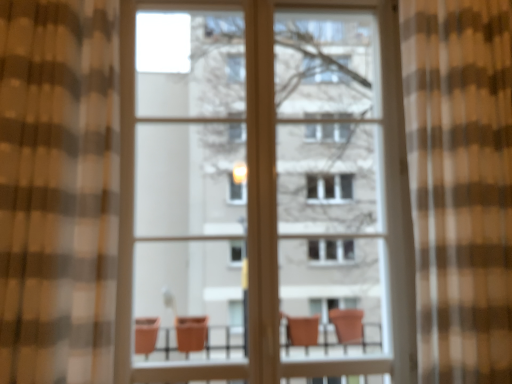
Question: From their relative heights in the image, would you say brown sheer curtain at right, marked as the first curtain in a right-to-left arrangement, is taller or shorter than matte glass screen door at center?

Choices:
 (A) tall
 (B) short

Answer: (B)

Question: Considering the positions of brown sheer curtain at right, marked as the first curtain in a right-to-left arrangement, and matte glass screen door at center in the image, is brown sheer curtain at right, marked as the first curtain in a right-to-left arrangement, bigger or smaller than matte glass screen door at center?

Choices:
 (A) big
 (B) small

Answer: (A)

Question: Based on their relative distances, which object is nearer to the brown sheer curtain at right, placed as the second curtain when sorted from left to right?

Choices:
 (A) matte glass screen door at center
 (B) brown checkered curtain at left, which is the 1th curtain from left to right

Answer: (B)

Question: Which of these objects is positioned closest to the brown sheer curtain at right, placed as the second curtain when sorted from left to right?

Choices:
 (A) brown checkered curtain at left, which is the 1th curtain from left to right
 (B) matte glass screen door at center

Answer: (A)